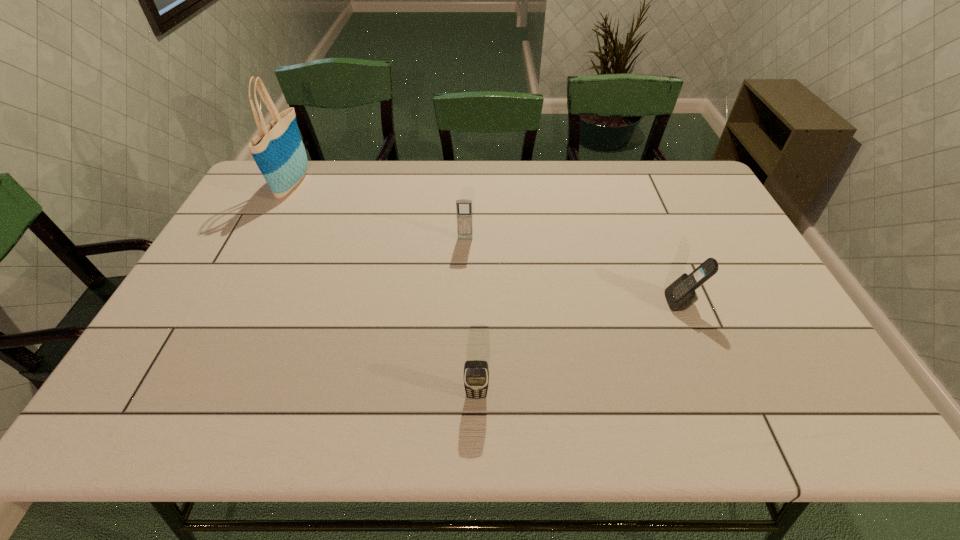
Image resolution: width=960 pixels, height=540 pixels. Identify the location of the farthest object. (278, 150).

You are a GUI agent. You are given a task and a screenshot of the screen. Output one action in this format:
    pyautogui.click(x=<x>, y=<y>)
    Task: Click on the leftmost object
    This screenshot has height=540, width=960.
    Given the screenshot: What is the action you would take?
    pyautogui.click(x=278, y=150)

Locate an element on the screen. Image resolution: width=960 pixels, height=540 pixels. the farthest cellular telephone is located at coordinates (463, 206).

Identify the location of the rightmost cellular telephone. The height and width of the screenshot is (540, 960). (680, 295).

Where is `the second farthest cellular telephone`? This screenshot has height=540, width=960. the second farthest cellular telephone is located at coordinates (680, 295).

Identify the location of the shortest object. The height and width of the screenshot is (540, 960). (476, 373).

Image resolution: width=960 pixels, height=540 pixels. I want to click on the shortest cellular telephone, so click(x=476, y=373).

Where is `free space located 0.330m on the right of the leftmost object`? free space located 0.330m on the right of the leftmost object is located at coordinates point(403,184).

Find the location of a particular element. The height and width of the screenshot is (540, 960). free space located 0.280m on the front-facing side of the farthest cellular telephone is located at coordinates (463, 315).

The width and height of the screenshot is (960, 540). I want to click on free space located on the front-facing side of the rightmost cellular telephone, so click(x=570, y=302).